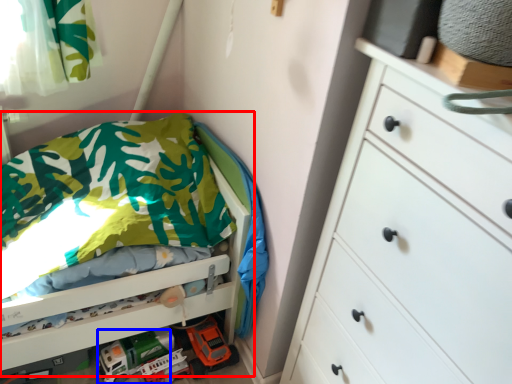
Question: Among these objects, which one is farthest to the camera, bed (highlighted by a red box) or toy car (highlighted by a blue box)?

Choices:
 (A) bed
 (B) toy car

Answer: (B)